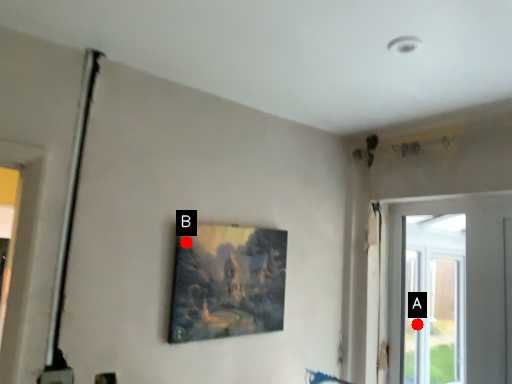
Question: Two points are circled on the image, labeled by A and B beside each circle. Which point is farther from the camera taking this photo?

Choices:
 (A) A is further
 (B) B is further

Answer: (A)